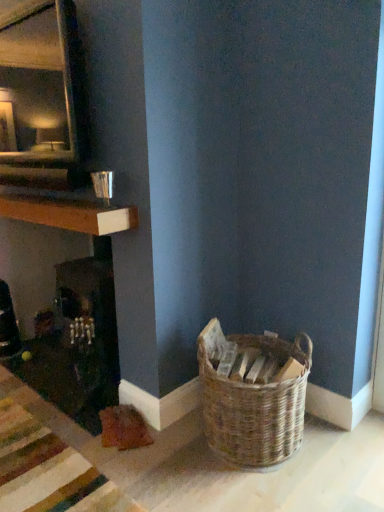
Question: In the image, is wooden at left on the left side or the right side of woven brown basket at lower right?

Choices:
 (A) right
 (B) left

Answer: (B)

Question: Is point (61, 221) closer or farther from the camera than point (243, 381)?

Choices:
 (A) farther
 (B) closer

Answer: (A)

Question: Choose the correct answer: Is wooden at left inside woven brown basket at lower right or outside it?

Choices:
 (A) outside
 (B) inside

Answer: (A)

Question: Is woven brown basket at lower right spatially inside wooden at left, or outside of it?

Choices:
 (A) inside
 (B) outside

Answer: (B)

Question: Looking at their shapes, would you say woven brown basket at lower right is wider or thinner than wooden at left?

Choices:
 (A) wide
 (B) thin

Answer: (A)

Question: Is point (289, 426) positioned closer to the camera than point (107, 220)?

Choices:
 (A) closer
 (B) farther

Answer: (A)

Question: Based on their positions, is woven brown basket at lower right located to the left or right of wooden at left?

Choices:
 (A) left
 (B) right

Answer: (B)